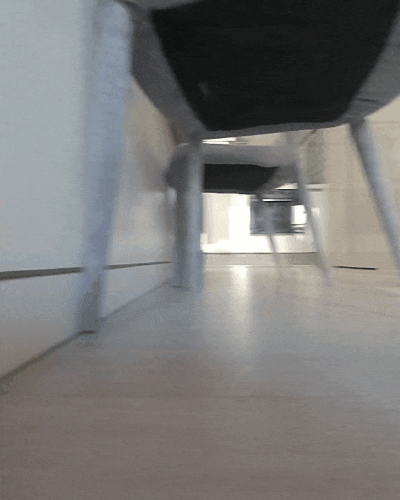
The width and height of the screenshot is (400, 500). I want to click on chair legs, so click(x=358, y=233).